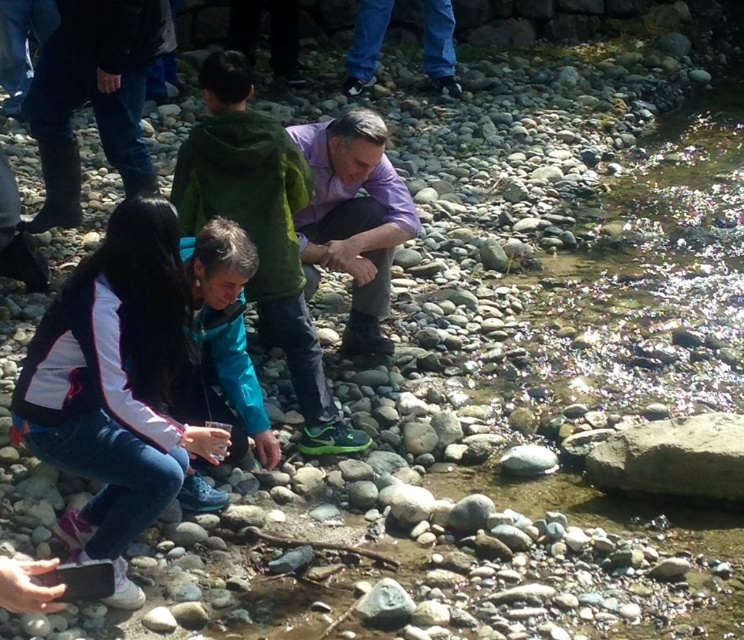
You are standing at the origin point of the coordinate system in this scene. You want to move towards the light purple shirt at center. Which direction should you head?

Since the light purple shirt at center is located at coordinate point (260, 228), you should move northeast to reach it.

You are a photographer standing at the edge of the stream and want to take a photo that includes both the dark blue jeans at upper left and the purple cotton shirt at center. Which object should you focus on first to ensure both are in sharp focus?

You should focus on the dark blue jeans at upper left first because it is closer to you than the purple cotton shirt at center, so focusing on the closer object will help both be in focus.